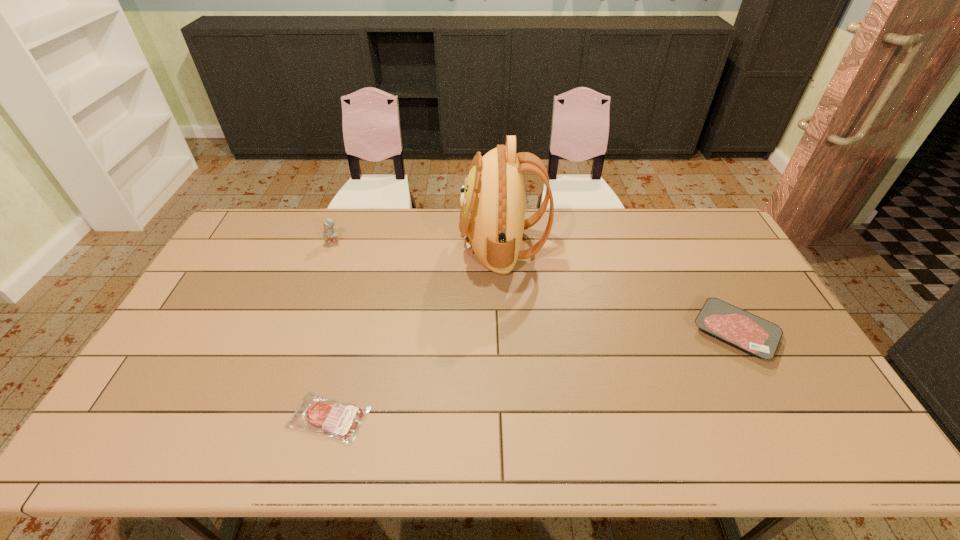
The height and width of the screenshot is (540, 960). I want to click on vacant space at the left edge of the desktop, so click(x=179, y=362).

Locate an element on the screen. vacant space at the right edge of the desktop is located at coordinates (740, 288).

Locate an element on the screen. The width and height of the screenshot is (960, 540). free space at the far left corner of the desktop is located at coordinates (272, 227).

This screenshot has width=960, height=540. Find the location of `free space between the nearer steak and the backpack`. free space between the nearer steak and the backpack is located at coordinates (416, 331).

Where is `free space that is in between the leftmost object and the second nearest object`? This screenshot has height=540, width=960. free space that is in between the leftmost object and the second nearest object is located at coordinates (534, 287).

This screenshot has height=540, width=960. I want to click on free spot between the tallest object and the third shortest object, so click(419, 244).

Where is `free space that is in between the nearest object and the right steak`? free space that is in between the nearest object and the right steak is located at coordinates (532, 375).

The image size is (960, 540). Find the location of `free space between the third shortest object and the second shortest object`. free space between the third shortest object and the second shortest object is located at coordinates [x=534, y=287].

This screenshot has height=540, width=960. In order to click on free space between the leftmost object and the right steak in this screenshot , I will do `click(534, 287)`.

You are a GUI agent. You are given a task and a screenshot of the screen. Output one action in this format:
    pyautogui.click(x=<x>, y=<y>)
    Task: Click on the free point between the nearer steak and the farther steak
    
    Given the screenshot: What is the action you would take?
    pyautogui.click(x=532, y=375)